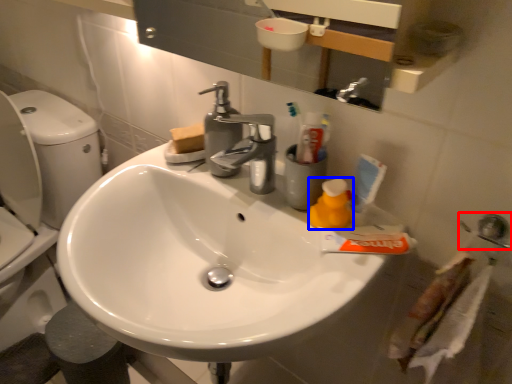
Question: Which point is further to the camera, plumbing fixture (highlighted by a red box) or cleaning product (highlighted by a blue box)?

Choices:
 (A) plumbing fixture
 (B) cleaning product

Answer: (B)